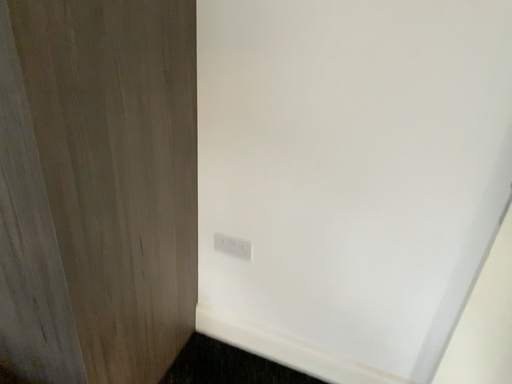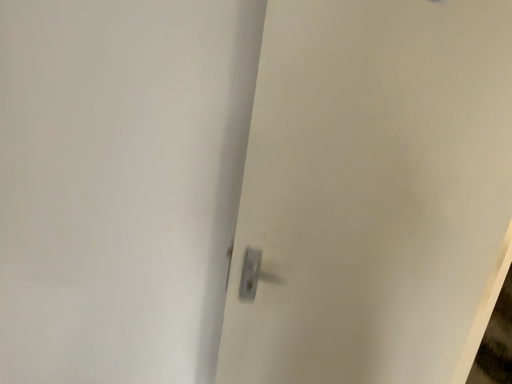
Question: Which way did the camera rotate in the video?

Choices:
 (A) rotated upward
 (B) rotated downward

Answer: (A)